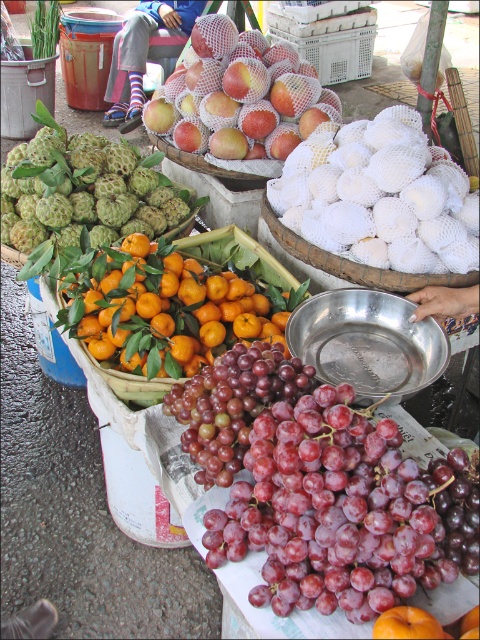
In the fruit stall scene, you notice the purple matte grapes at center and the white mesh basket at center. Which object takes up more space in the image?

The white mesh basket at center takes up more space in the image because the purple matte grapes at center has a smaller size compared to it.

You are standing at the fruit stall and want to pick up the grapes located at point (375, 504) and the tangerines at point (189, 77). Which fruit will you reach first?

You will reach the grapes located at point (375, 504) first because it is closer to you than the tangerines at point (189, 77).

You are standing at the fruit stall and want to pick up two items. The first item is at point [99,186] and the second item is at point [372,24]. Which item will you reach first if you move directly toward them?

The item at point [99,186] will be reached first because it is closer to you than the item at point [372,24].